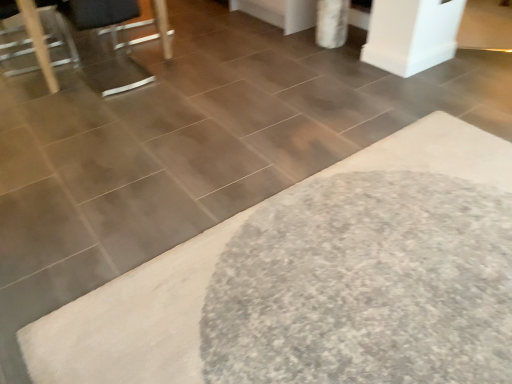
Question: Considering the positions of metallic silver swivel chair at upper left and metallic silver chair at left in the image, is metallic silver swivel chair at upper left taller or shorter than metallic silver chair at left?

Choices:
 (A) short
 (B) tall

Answer: (B)

Question: Considering the positions of metallic silver swivel chair at upper left and metallic silver chair at left in the image, is metallic silver swivel chair at upper left bigger or smaller than metallic silver chair at left?

Choices:
 (A) small
 (B) big

Answer: (B)

Question: Considering the real-world distances, which object is closest to the white shaggy bath mat at lower right?

Choices:
 (A) metallic silver swivel chair at upper left
 (B) metallic silver chair at left

Answer: (A)

Question: Considering the real-world distances, which object is farthest from the metallic silver swivel chair at upper left?

Choices:
 (A) white shaggy bath mat at lower right
 (B) metallic silver chair at left

Answer: (A)